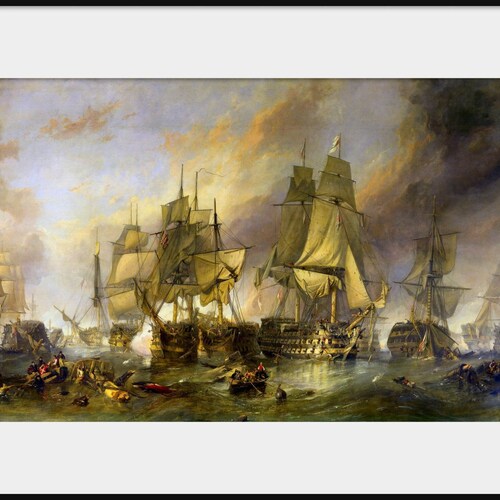
You are a GUI agent. You are given a task and a screenshot of the screen. Output one action in this format:
    pyautogui.click(x=<x>, y=<y>)
    Task: Click on the drape
    
    Given the screenshot: What is the action you would take?
    pyautogui.click(x=338, y=236)